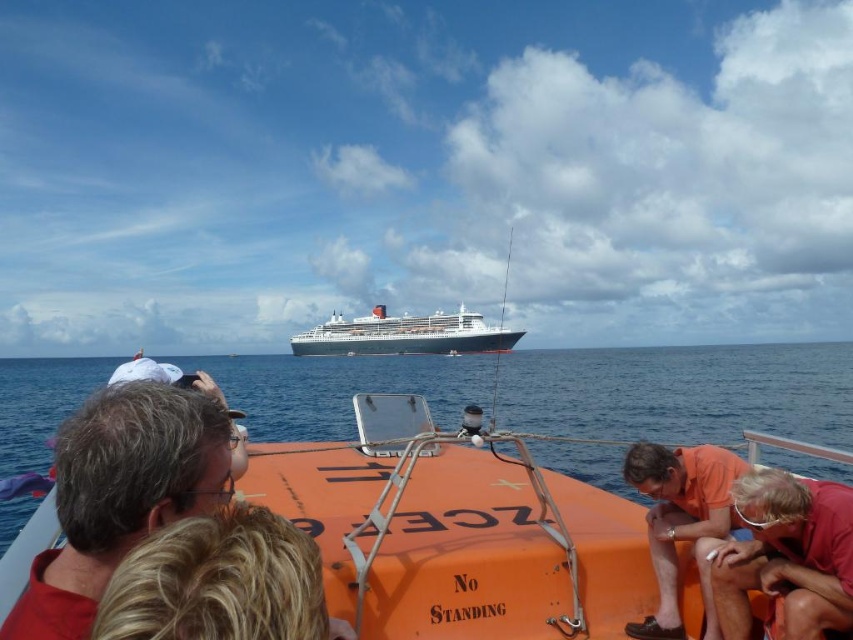
You are on the deck of a boat and see an orange matte shirt at lower right and a white glossy cruise ship at center. Which object is located more to the right side?

The orange matte shirt at lower right is positioned on the right side of the white glossy cruise ship at center, so it is more to the right.

You are an observer on the deck of the boat. You notice a red shirt at left and a white glossy cruise ship at center. Which object is closer to you?

The red shirt at left is closer to you because it is positioned over the white glossy cruise ship at center, indicating it is in front of it from your viewpoint.

You are on the deck of the smaller boat and want to move from the point at coordinates point(209, 502) to the point at point(512, 340). Which direction should you move in relation to the cruise ship?

You should move towards the cruise ship because point(209, 502) is in front of point(512, 340), meaning the latter is closer to the cruise ship.